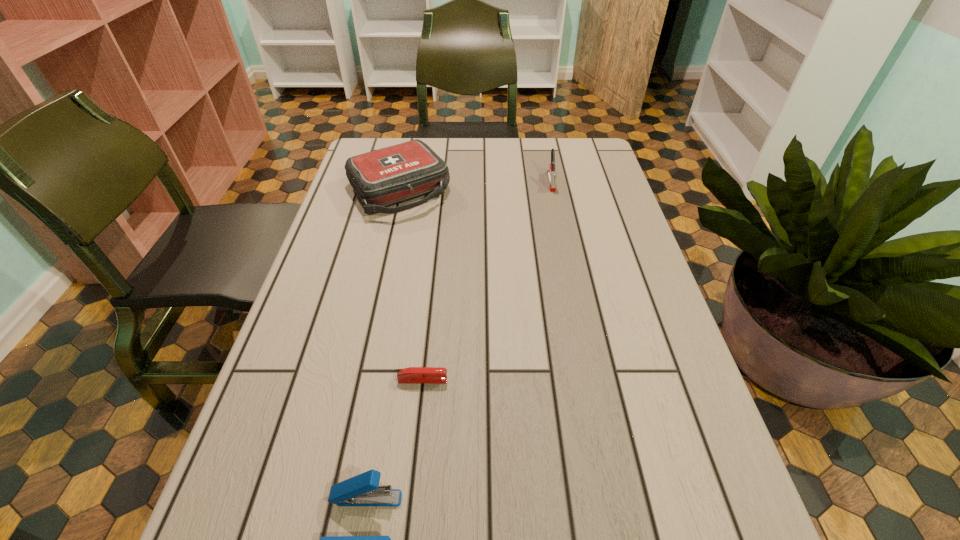
Locate an element on the screen. The height and width of the screenshot is (540, 960). free location that satisfies the following two spatial constraints: 1. on the handle side of the farthest stapler; 2. on the front-facing side of the second farthest stapler is located at coordinates 591,380.